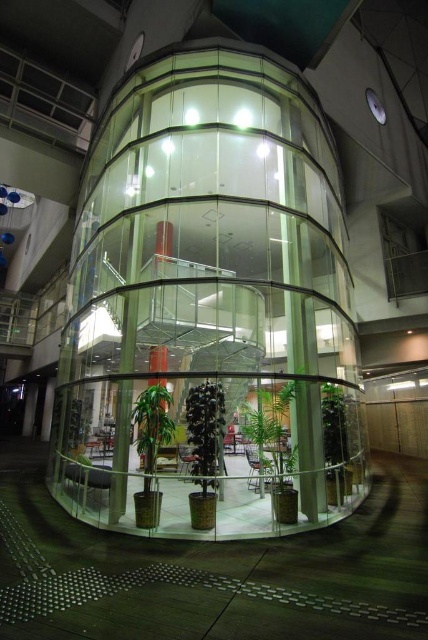
Question: Among these objects, which one is farthest from the camera?

Choices:
 (A) green matte plant at center
 (B) green glossy plant at center

Answer: (A)

Question: Can you confirm if green glossy plant at center is smaller than green matte plant at center?

Choices:
 (A) no
 (B) yes

Answer: (A)

Question: Which of the following is the farthest from the observer?

Choices:
 (A) green glossy plant at center
 (B) green matte plant at center

Answer: (B)

Question: Does green glossy plant at center appear on the right side of green matte plant at center?

Choices:
 (A) yes
 (B) no

Answer: (A)

Question: Which of the following is the closest to the observer?

Choices:
 (A) green matte plant at center
 (B) green glossy plant at center

Answer: (B)

Question: Considering the relative positions of green glossy plant at center and green matte plant at center in the image provided, where is green glossy plant at center located with respect to green matte plant at center?

Choices:
 (A) right
 (B) left

Answer: (A)